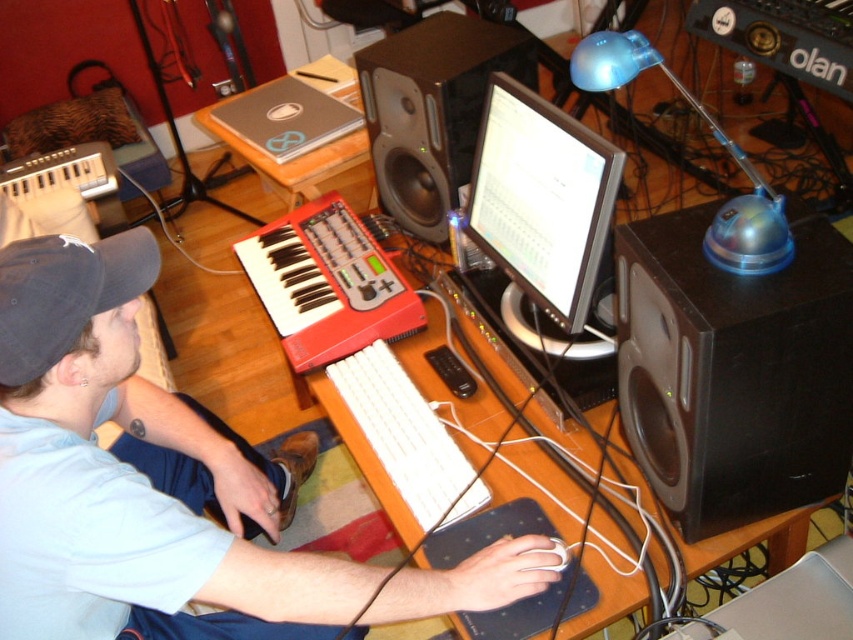
You are a music producer setting up your studio. You have a white matte keyboard at center and a black matte speaker at upper center on your desk. Which object is taller?

The white matte keyboard at center is much taller than the black matte speaker at upper center.

You are a sound engineer who needs to adjust the settings on the white matte keyboard at center. You have a tool that requires precise placement and can only reach up to 90 centimeters. Can you comfortably reach the keyboard without moving your chair?

The white matte keyboard at center is 88.09 centimeters away from the viewer. Since the tool can reach up to 90 centimeters, you can comfortably adjust the settings without needing to move your chair.

You are a music producer setting up your studio. You need to place a new microphone stand between the black matte speaker at upper center and the white plastic keyboard at center. Based on their positions, which side of the white plastic keyboard should the microphone stand be placed?

The black matte speaker at upper center is to the right of the white plastic keyboard at center, so the microphone stand should be placed to the right side of the white plastic keyboard at center.